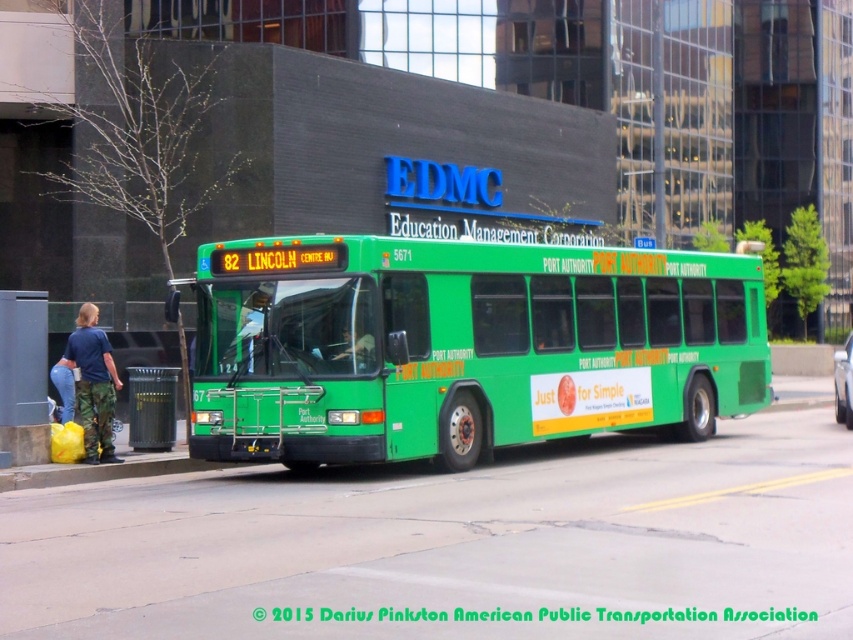
You are a fashion designer observing the urban scene. You notice the blue camouflage pants at lower left and the matte black jacket at center. Which clothing item appears bigger in the image?

The blue camouflage pants at lower left is larger in size than the matte black jacket at center.

You are standing at the center of the scene and want to find the metallic gray bus stop at lower left. In which direction should you look to see it?

You should look to the lower left direction to see the metallic gray bus stop at lower left since its 2D location is at point [22,376].

You are a pedestrian standing at the edge of the scene and want to find the closest object to you. Which one is closer between the metallic gray bus stop at lower left and the blue camouflage pants at lower left?

The metallic gray bus stop at lower left is closer because it occupies less space than the blue camouflage pants at lower left, indicating it is nearer to the viewer.